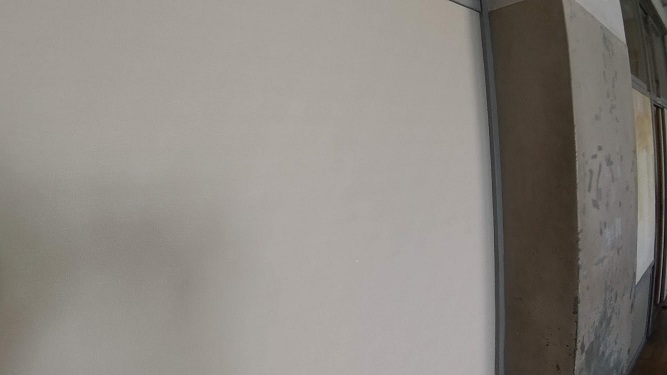
The image size is (667, 375). Identify the location of painted wall. (145, 211).